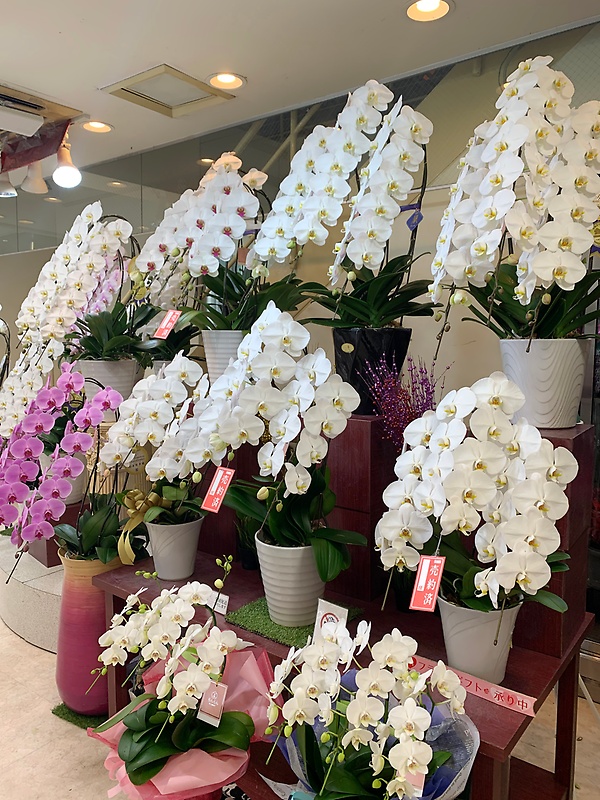
You are a GUI agent. You are given a task and a screenshot of the screen. Output one action in this format:
    pyautogui.click(x=<x>, y=<y>)
    Task: Click on the floor
    
    Given the screenshot: What is the action you would take?
    pyautogui.click(x=57, y=770)